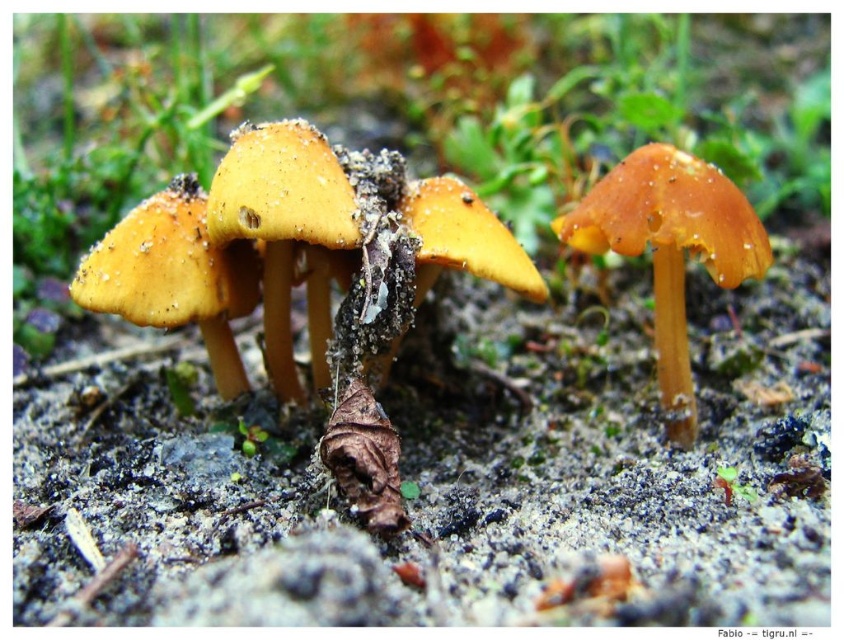
You are a hiker trying to navigate through the mushroom area. You see two points marked as point (306,144) and point (104,257). Which point is closer to you?

Point (306,144) is in front of point (104,257), so it is closer to you.

You are standing at the point with coordinates point (669, 248). Looking around, you see an orange matte mushroom at center. Which direction should you move to reach the orange matte mushroom at center?

The point (669, 248) is already on the orange matte mushroom at center, so you are already at the mushroom.

You are an artist drawing this scene and want to place the yellow matte mushroom at center accurately. According to the coordinates provided, where should you position it on your canvas?

The yellow matte mushroom at center should be positioned at the coordinates point (x=287, y=232) on the canvas.